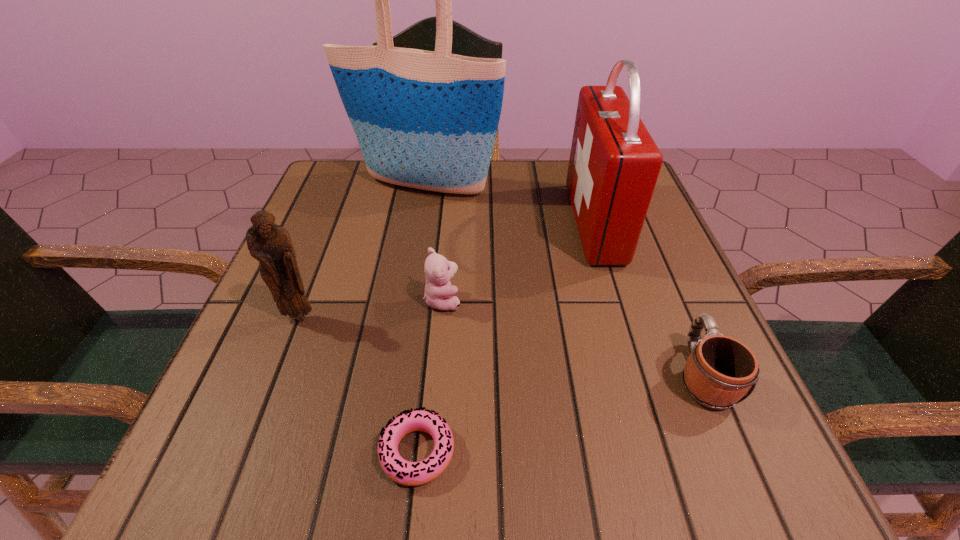
Locate an element on the screen. vacant space located on the front face of the first-aid kit is located at coordinates (519, 222).

This screenshot has width=960, height=540. I want to click on free location located 0.270m on the front face of the first-aid kit, so click(452, 222).

Locate an element on the screen. vacant space situated on the front face of the first-aid kit is located at coordinates (538, 222).

This screenshot has width=960, height=540. I want to click on free location located 0.080m on the front-facing side of the third tallest object, so click(x=282, y=362).

The height and width of the screenshot is (540, 960). Identify the location of blank area located at the face of the fourth tallest object. (618, 300).

Find the location of a particular element. vacant space situated 0.320m on the side of the mug with the handle is located at coordinates (638, 224).

Where is `vacant space located 0.280m on the side of the mug with the handle`? vacant space located 0.280m on the side of the mug with the handle is located at coordinates (643, 236).

Identify the location of free space located on the side of the mug with the handle. (661, 278).

Where is `vacant area located on the left of the nearest object`? The height and width of the screenshot is (540, 960). vacant area located on the left of the nearest object is located at coordinates [307, 452].

Find the location of a particular element. The height and width of the screenshot is (540, 960). tote bag situated at the far edge is located at coordinates (428, 120).